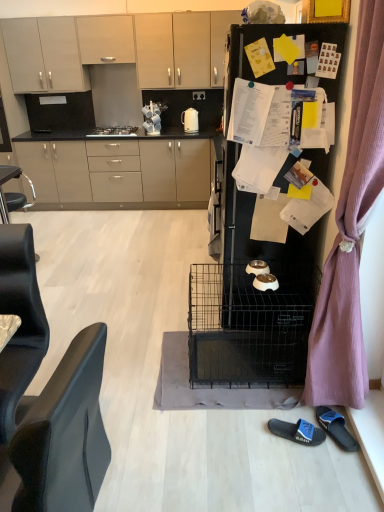
Question: Does matte beige cabinets at center, which is the 4th cabinetry from top to bottom, lie behind purple fabric curtain at right?

Choices:
 (A) no
 (B) yes

Answer: (B)

Question: From the image's perspective, would you say matte beige cabinets at center, which is the 4th cabinetry from top to bottom, is positioned over purple fabric curtain at right?

Choices:
 (A) no
 (B) yes

Answer: (B)

Question: From a real-world perspective, is matte beige cabinets at center, which is the 4th cabinetry from top to bottom, physically above purple fabric curtain at right?

Choices:
 (A) no
 (B) yes

Answer: (A)

Question: Is matte beige cabinets at center, the first cabinetry positioned from the bottom, aimed at purple fabric curtain at right?

Choices:
 (A) yes
 (B) no

Answer: (A)

Question: Does matte beige cabinets at center, which is the 4th cabinetry from top to bottom, appear on the right side of purple fabric curtain at right?

Choices:
 (A) no
 (B) yes

Answer: (A)

Question: From the image's perspective, is white glossy electric kettle at upper center positioned above or below matte beige cabinets at center, which is the 4th cabinetry from top to bottom?

Choices:
 (A) below
 (B) above

Answer: (B)

Question: Considering the positions of point (196, 119) and point (122, 188), is point (196, 119) closer or farther from the camera than point (122, 188)?

Choices:
 (A) farther
 (B) closer

Answer: (B)

Question: From a real-world perspective, is white glossy electric kettle at upper center positioned above or below matte beige cabinets at center, which is the 4th cabinetry from top to bottom?

Choices:
 (A) above
 (B) below

Answer: (A)

Question: Is white glossy electric kettle at upper center in front of or behind matte beige cabinets at center, the first cabinetry positioned from the bottom, in the image?

Choices:
 (A) behind
 (B) front

Answer: (A)

Question: Based on their sizes in the image, would you say black matte refrigerator at upper right is bigger or smaller than white glossy coffee cup at upper center?

Choices:
 (A) small
 (B) big

Answer: (B)

Question: From a real-world perspective, is black matte refrigerator at upper right positioned above or below white glossy coffee cup at upper center?

Choices:
 (A) below
 (B) above

Answer: (A)

Question: In terms of width, does black matte refrigerator at upper right look wider or thinner when compared to white glossy coffee cup at upper center?

Choices:
 (A) wide
 (B) thin

Answer: (A)

Question: Is black matte refrigerator at upper right inside or outside of white glossy coffee cup at upper center?

Choices:
 (A) inside
 (B) outside

Answer: (B)

Question: Based on their positions, is matte beige cabinets at center, the first cabinetry positioned from the bottom, located to the left or right of matte gray cabinets at upper left, placed as the second cabinetry when sorted from bottom to top?

Choices:
 (A) right
 (B) left

Answer: (A)

Question: Considering the positions of matte beige cabinets at center, the first cabinetry positioned from the bottom, and matte gray cabinets at upper left, placed as the second cabinetry when sorted from bottom to top, in the image, is matte beige cabinets at center, the first cabinetry positioned from the bottom, wider or thinner than matte gray cabinets at upper left, placed as the second cabinetry when sorted from bottom to top,?

Choices:
 (A) thin
 (B) wide

Answer: (B)